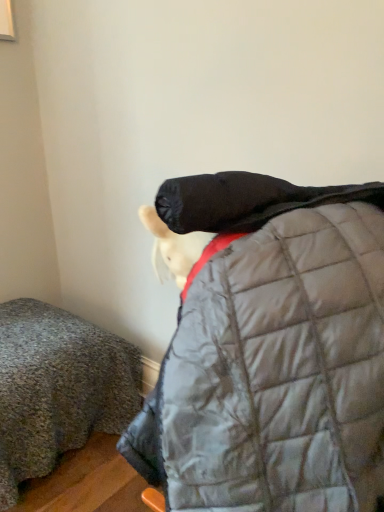
At what (x,y) coordinates should I click in order to perform the action: click on silver quilted jacket at center. Please return your answer as a coordinate pair (x, y). Looking at the image, I should click on (271, 351).

This screenshot has width=384, height=512. What do you see at coordinates (271, 351) in the screenshot? I see `silver quilted jacket at center` at bounding box center [271, 351].

Measure the distance between point (295, 344) and camera.

The depth of point (295, 344) is 59.80 centimeters.

Where is `textured gray blanket at lower left`? textured gray blanket at lower left is located at coordinates (58, 388).

This screenshot has height=512, width=384. Describe the element at coordinates (58, 388) in the screenshot. I see `textured gray blanket at lower left` at that location.

Find the location of a particular element. silver quilted jacket at center is located at coordinates (271, 351).

Which object is positioned more to the left, textured gray blanket at lower left or silver quilted jacket at center?

Positioned to the left is textured gray blanket at lower left.

Is textured gray blanket at lower left further to camera compared to silver quilted jacket at center?

Yes.

Considering the points (3, 343) and (293, 274), which point is in front, point (3, 343) or point (293, 274)?

The point (293, 274) is closer to the camera.

From the image's perspective, is textured gray blanket at lower left above silver quilted jacket at center?

Yes.

From a real-world perspective, is textured gray blanket at lower left above or below silver quilted jacket at center?

From a real-world perspective, textured gray blanket at lower left is physically below silver quilted jacket at center.

Is textured gray blanket at lower left wider or thinner than silver quilted jacket at center?

textured gray blanket at lower left is wider than silver quilted jacket at center.

Who is shorter, textured gray blanket at lower left or silver quilted jacket at center?

textured gray blanket at lower left.

Looking at this image, can you confirm if textured gray blanket at lower left is bigger than silver quilted jacket at center?

Yes, textured gray blanket at lower left is bigger than silver quilted jacket at center.

Is textured gray blanket at lower left spatially inside silver quilted jacket at center, or outside of it?

textured gray blanket at lower left cannot be found inside silver quilted jacket at center.

Would you say textured gray blanket at lower left is a long distance from silver quilted jacket at center?

No.

Is silver quilted jacket at center at the back of textured gray blanket at lower left?

No.

What's the angular difference between textured gray blanket at lower left and silver quilted jacket at center's facing directions?

The facing directions of textured gray blanket at lower left and silver quilted jacket at center are 179 degrees apart.

Identify the location of jacket below the textured gray blanket at lower left (from the image's perspective). This screenshot has width=384, height=512. (271, 351).

Which object is positioned more to the left, silver quilted jacket at center or textured gray blanket at lower left?

From the viewer's perspective, textured gray blanket at lower left appears more on the left side.

Considering the relative positions of silver quilted jacket at center and textured gray blanket at lower left in the image provided, is silver quilted jacket at center in front of textured gray blanket at lower left?

Yes, silver quilted jacket at center is closer to the camera.

Is point (203, 311) closer to viewer compared to point (5, 357)?

Yes, point (203, 311) is closer to viewer.

From the image's perspective, which object appears higher, silver quilted jacket at center or textured gray blanket at lower left?

From the image's view, textured gray blanket at lower left is above.

From a real-world perspective, relative to textured gray blanket at lower left, is silver quilted jacket at center vertically above or below?

Clearly, from a real-world perspective, silver quilted jacket at center is above textured gray blanket at lower left.

Considering the relative sizes of silver quilted jacket at center and textured gray blanket at lower left in the image provided, is silver quilted jacket at center thinner than textured gray blanket at lower left?

Yes, silver quilted jacket at center is thinner than textured gray blanket at lower left.

Does silver quilted jacket at center have a lesser height compared to textured gray blanket at lower left?

No, silver quilted jacket at center is not shorter than textured gray blanket at lower left.

In terms of size, does silver quilted jacket at center appear bigger or smaller than textured gray blanket at lower left?

In the image, silver quilted jacket at center appears to be smaller than textured gray blanket at lower left.

Consider the image. Is silver quilted jacket at center completely or partially outside of textured gray blanket at lower left?

That's correct, silver quilted jacket at center is outside of textured gray blanket at lower left.

Is silver quilted jacket at center not close to textured gray blanket at lower left?

No, there isn't a large distance between silver quilted jacket at center and textured gray blanket at lower left.

Is silver quilted jacket at center looking in the opposite direction of textured gray blanket at lower left?

No.

At what (x,y) coordinates should I click in order to perform the action: click on jacket that appears in front of the textured gray blanket at lower left. Please return your answer as a coordinate pair (x, y). Looking at the image, I should click on 271,351.

The image size is (384, 512). Find the location of `furniture located behind the silver quilted jacket at center`. furniture located behind the silver quilted jacket at center is located at coordinates (58, 388).

Where is `furniture below the silver quilted jacket at center (from a real-world perspective)`? This screenshot has width=384, height=512. furniture below the silver quilted jacket at center (from a real-world perspective) is located at coordinates (58, 388).